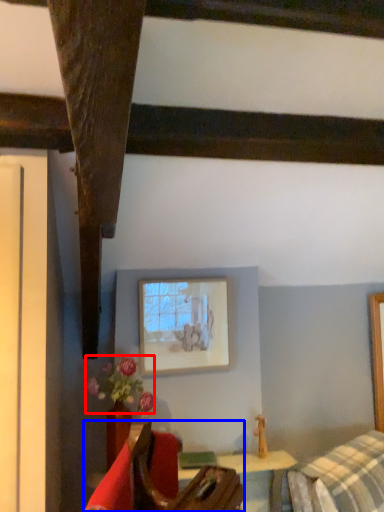
Question: Which of the following is the closest to the observer, flower (highlighted by a red box) or furniture (highlighted by a blue box)?

Choices:
 (A) flower
 (B) furniture

Answer: (B)